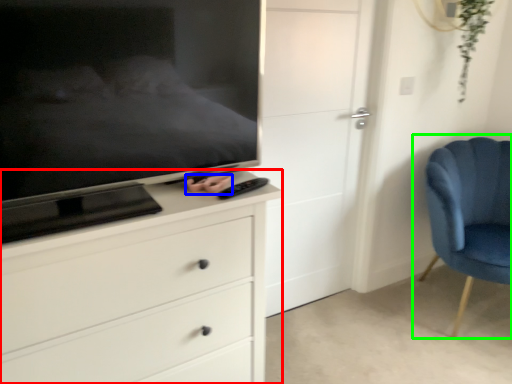
Question: Estimate the real-world distances between objects in this image. Which object is closer to chest of drawers (highlighted by a red box), hand (highlighted by a blue box) or chair (highlighted by a green box)?

Choices:
 (A) hand
 (B) chair

Answer: (A)